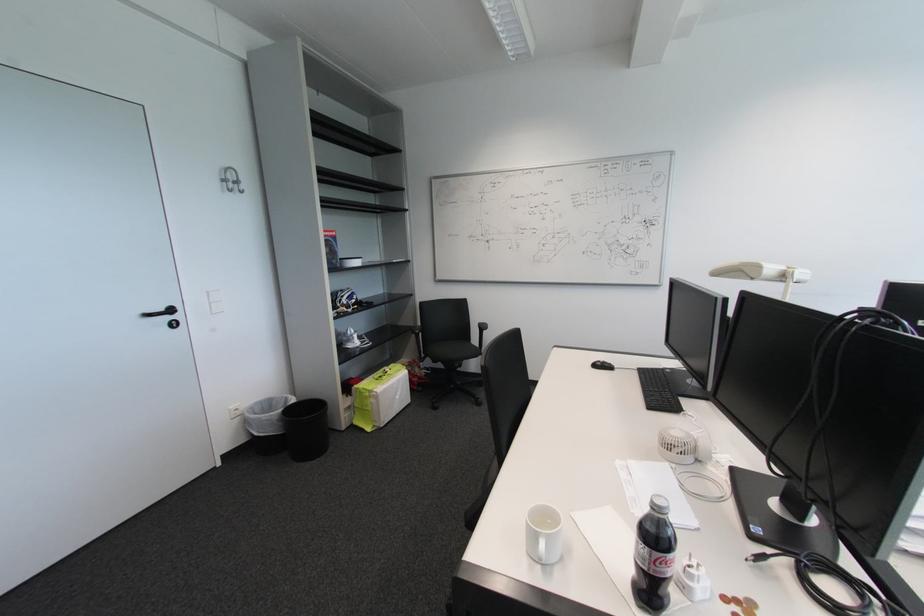
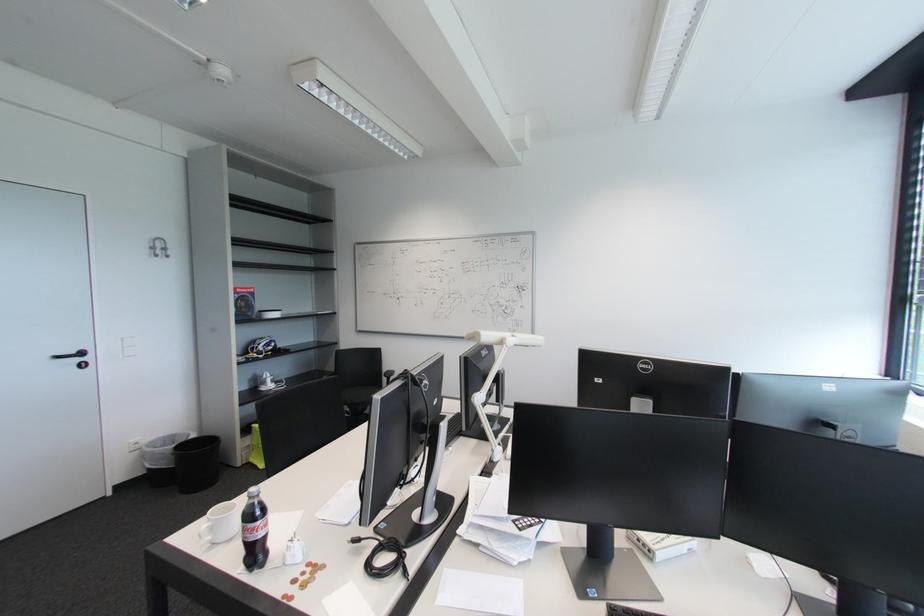
The point at (x=175, y=320) is marked in the first image. Where is the corresponding point in the second image?

(83, 361)